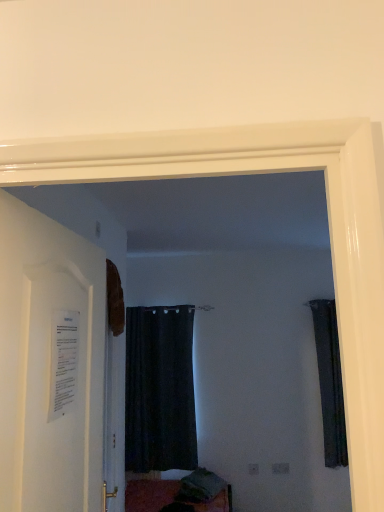
Question: From a real-world perspective, is black matte curtain at center, which ranks as the 1th curtain in left-to-right order, positioned under white paper at left based on gravity?

Choices:
 (A) no
 (B) yes

Answer: (B)

Question: Does black matte curtain at center, the second curtain from the right, touch white paper at left?

Choices:
 (A) no
 (B) yes

Answer: (A)

Question: Does black matte curtain at center, which ranks as the 1th curtain in left-to-right order, have a greater width compared to white paper at left?

Choices:
 (A) no
 (B) yes

Answer: (B)

Question: Is black matte curtain at center, which ranks as the 1th curtain in left-to-right order, outside white paper at left?

Choices:
 (A) no
 (B) yes

Answer: (B)

Question: Does black matte curtain at center, which ranks as the 1th curtain in left-to-right order, come behind white paper at left?

Choices:
 (A) yes
 (B) no

Answer: (A)

Question: Is white paper at left facing towards dark fabric curtain at right, which is counted as the 1th curtain, starting from the right?

Choices:
 (A) yes
 (B) no

Answer: (B)

Question: Would you consider white paper at left to be distant from dark fabric curtain at right, which is counted as the 1th curtain, starting from the right?

Choices:
 (A) yes
 (B) no

Answer: (A)

Question: Are white paper at left and dark fabric curtain at right, which is the 2th curtain in left-to-right order, making contact?

Choices:
 (A) no
 (B) yes

Answer: (A)

Question: Is white paper at left not within dark fabric curtain at right, which is the 2th curtain in left-to-right order?

Choices:
 (A) yes
 (B) no

Answer: (A)

Question: Is white paper at left to the left of dark fabric curtain at right, which is counted as the 1th curtain, starting from the right, from the viewer's perspective?

Choices:
 (A) no
 (B) yes

Answer: (B)

Question: Does white paper at left have a greater height compared to dark fabric curtain at right, which is counted as the 1th curtain, starting from the right?

Choices:
 (A) yes
 (B) no

Answer: (B)

Question: Is black matte curtain at center, which ranks as the 1th curtain in left-to-right order, completely or partially outside of dark fabric curtain at right, which is counted as the 1th curtain, starting from the right?

Choices:
 (A) no
 (B) yes

Answer: (B)